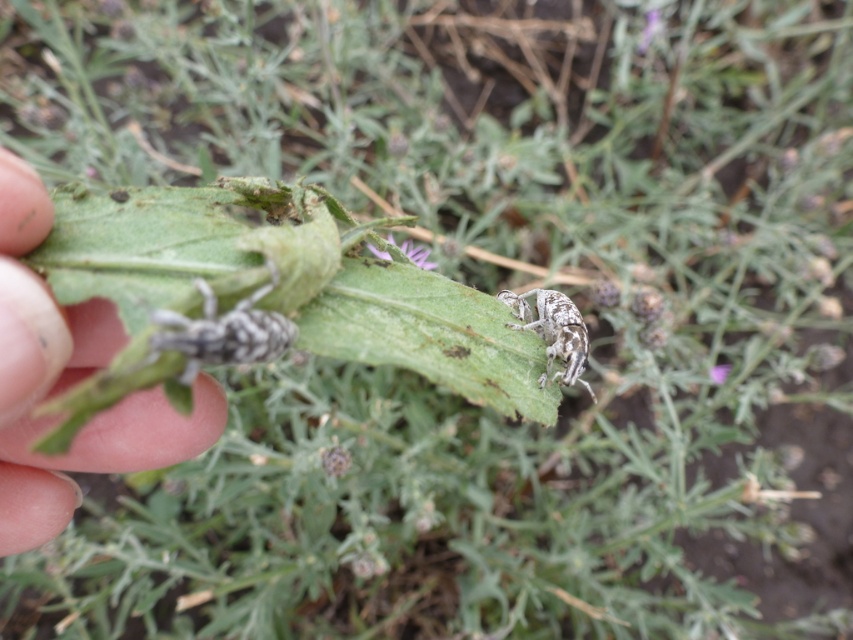
Question: Which of these objects is positioned closest to the purple matte flower at center?

Choices:
 (A) gray matte insect at left
 (B) gray matte insect at center
 (C) white matte insect at center

Answer: (C)

Question: Does flesh-toned skin at lower left appear over white matte insect at center?

Choices:
 (A) yes
 (B) no

Answer: (B)

Question: Among these points, which one is nearest to the camera?

Choices:
 (A) (242, 355)
 (B) (572, 310)
 (C) (4, 417)

Answer: (C)

Question: Is gray matte insect at left wider than white matte insect at center?

Choices:
 (A) no
 (B) yes

Answer: (B)

Question: Which of the following is the farthest from the observer?

Choices:
 (A) gray matte insect at left
 (B) flesh-toned skin at lower left
 (C) gray matte insect at center

Answer: (C)

Question: Can you confirm if gray matte insect at center is smaller than purple matte flower at center?

Choices:
 (A) no
 (B) yes

Answer: (B)